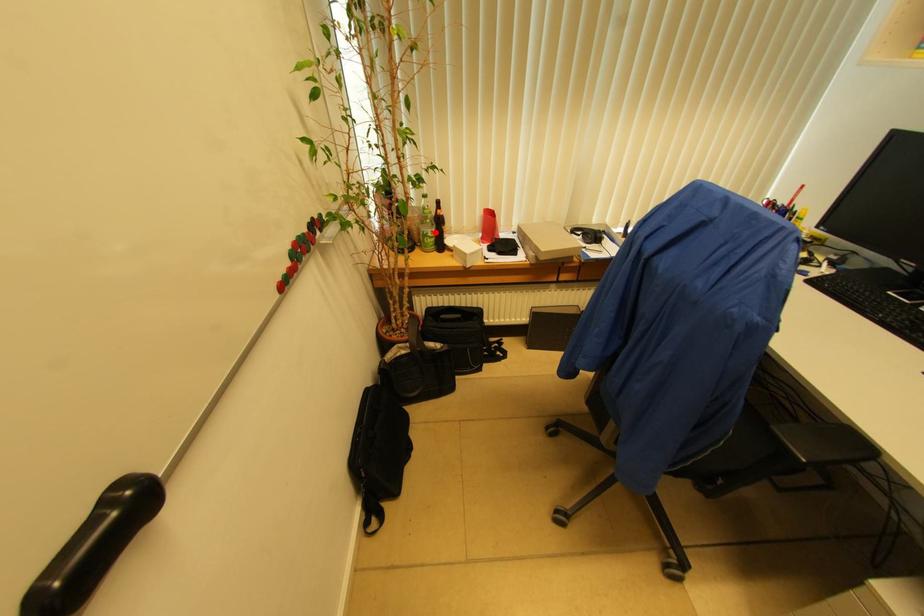
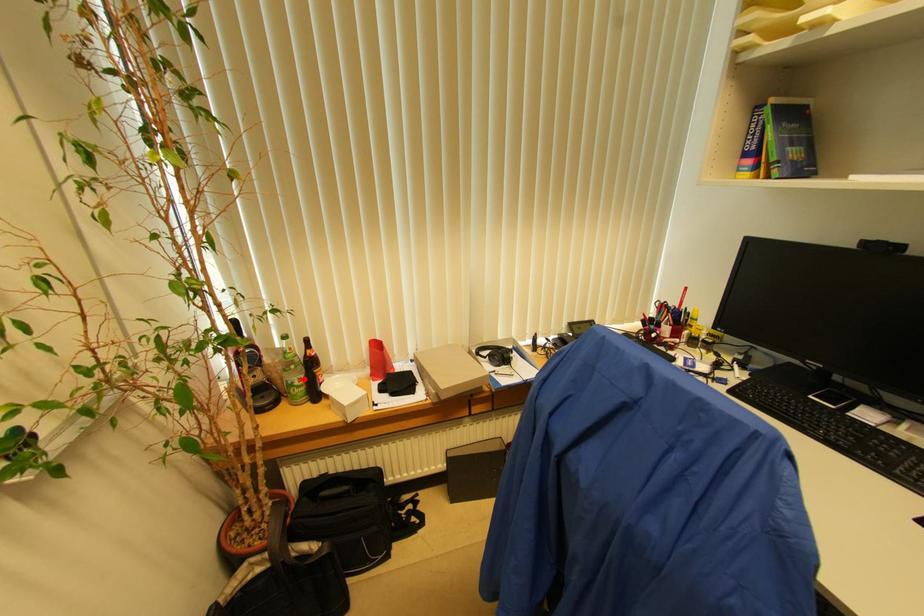
I am providing you with two images of the same scene from different viewpoints. A red point is marked on the first image and another point is marked on the second image. Does the point marked in image1 correspond to the same location as the one in image2?

Yes